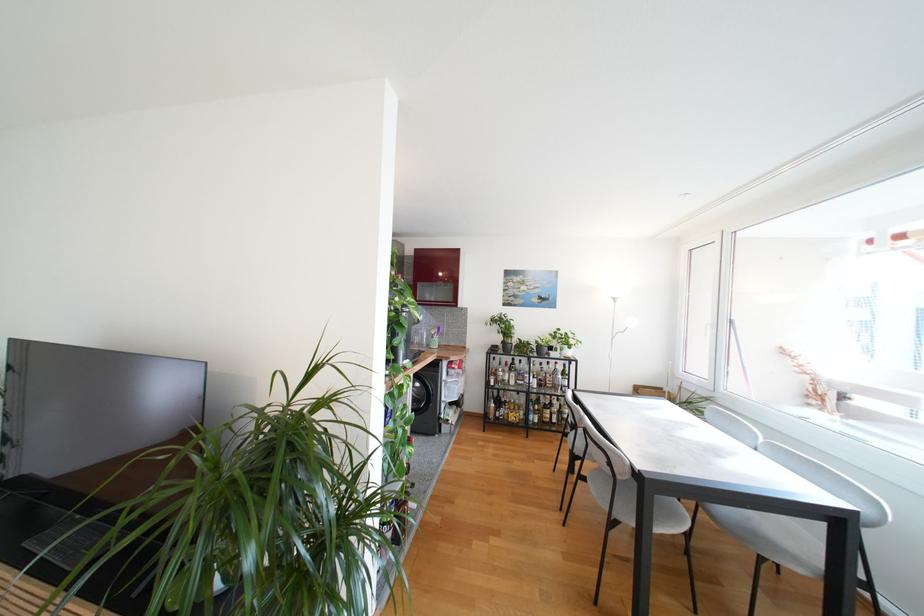
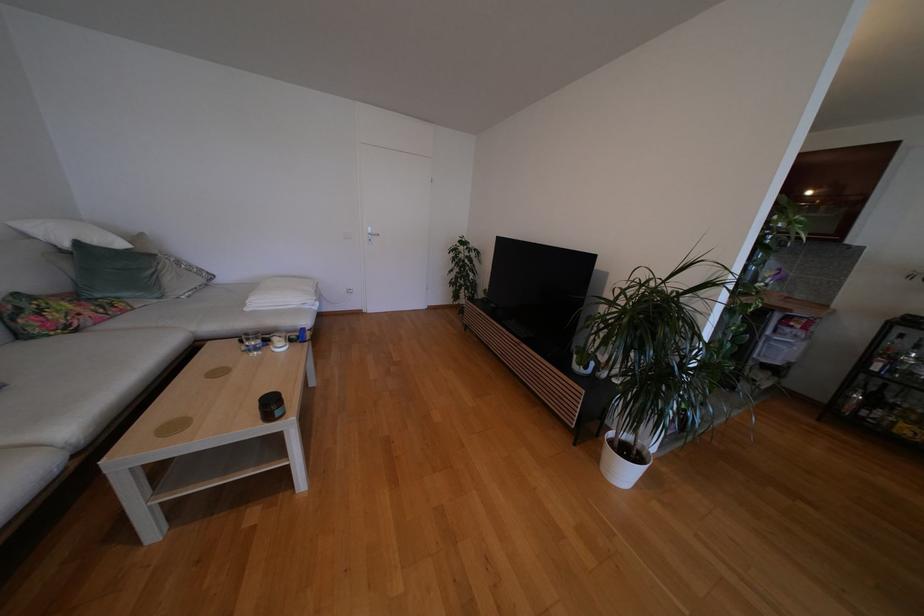
How did the camera likely rotate?

The camera rotated toward left-down.